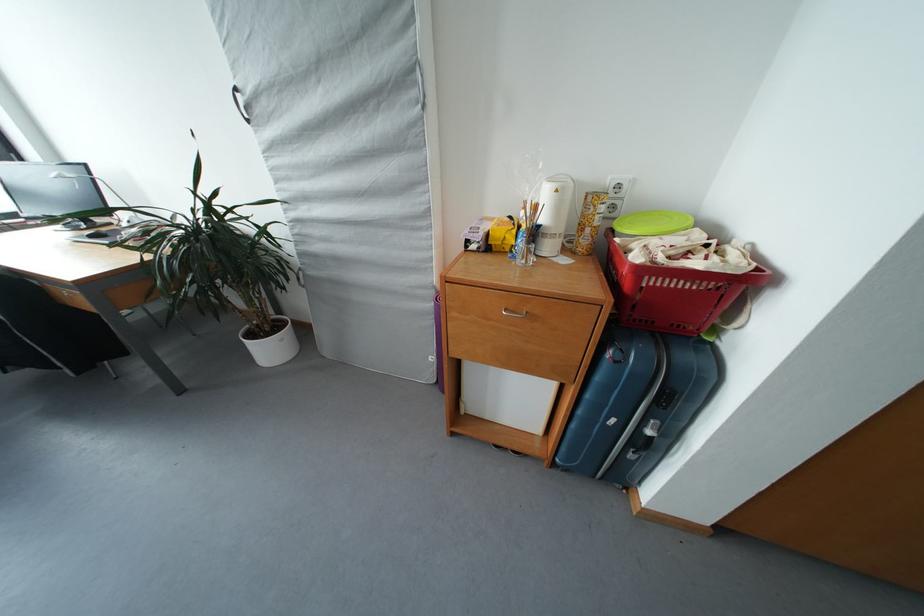
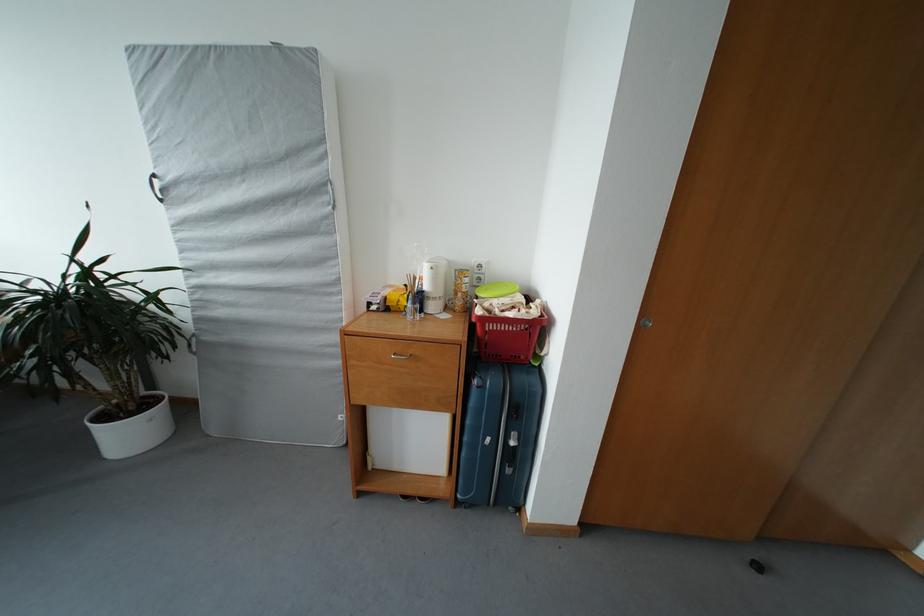
In the second image, find the point that corresponds to the point at 655,437 in the first image.

(518, 448)